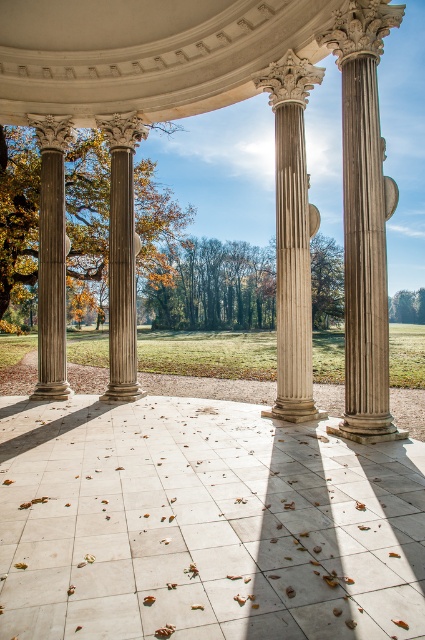
You are an architect visiting a classical pavilion. You notice the marble column at right and the green leafy tree at center. Which object is taller? Please base your answer on the scene description provided.

The marble column at right is taller than the green leafy tree at center.

You are an architect analyzing the classical pavilion. You notice the autumn leaves at left and the smooth stone column at left. Which object takes up more space in the image?

The autumn leaves at left are larger in size than the smooth stone column at left, so they take up more space in the image.

You are standing in the pavilion and want to take a photo of the marble column at right and the green leafy tree at center. Which object should you position closer to the camera to ensure both are in focus?

To ensure both the marble column at right and the green leafy tree at center are in focus, position the marble column at right closer to the camera since it is in front of the green leafy tree at center.